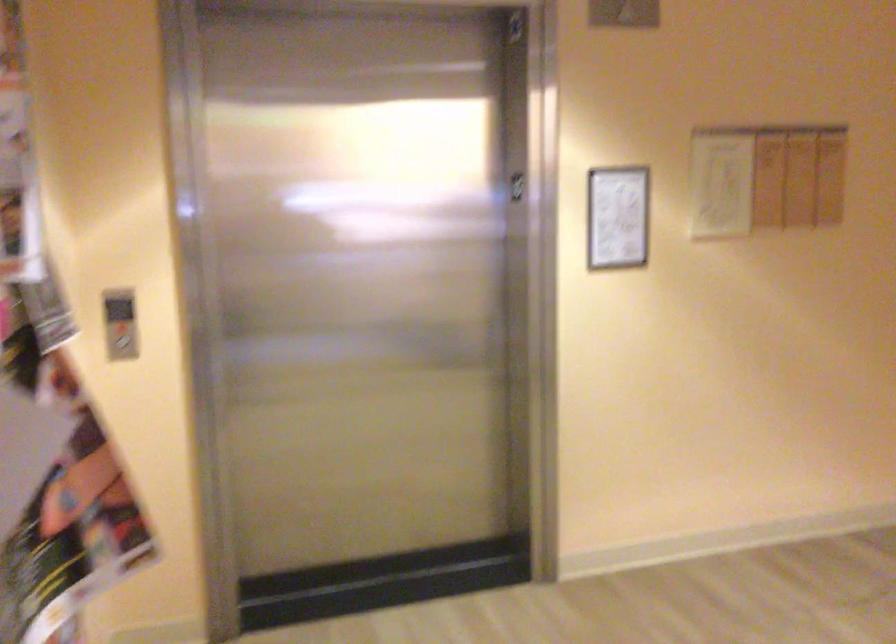
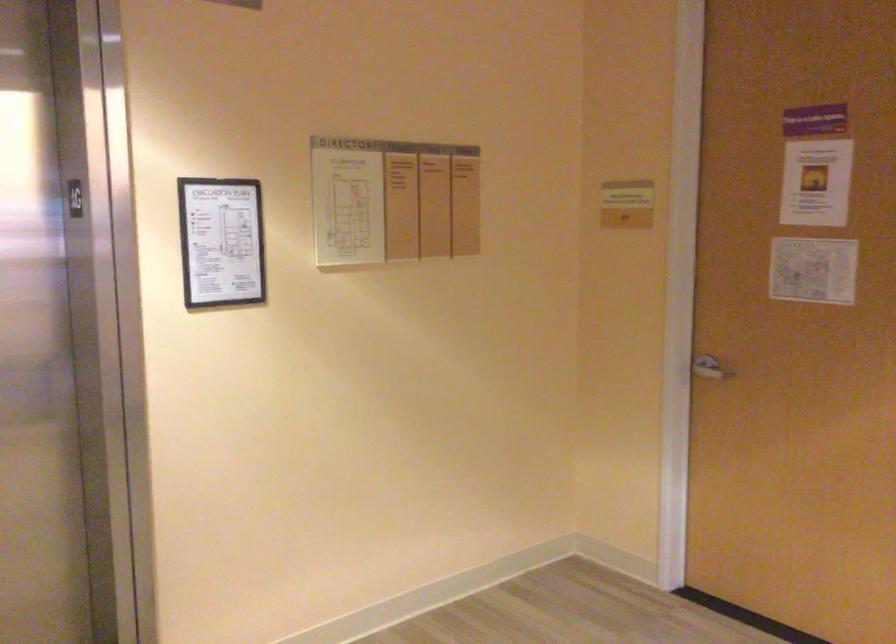
Question: The images are taken continuously from a first-person perspective. In which direction is your viewpoint rotating?

Choices:
 (A) Left
 (B) Right
 (C) Up
 (D) Down

Answer: (B)